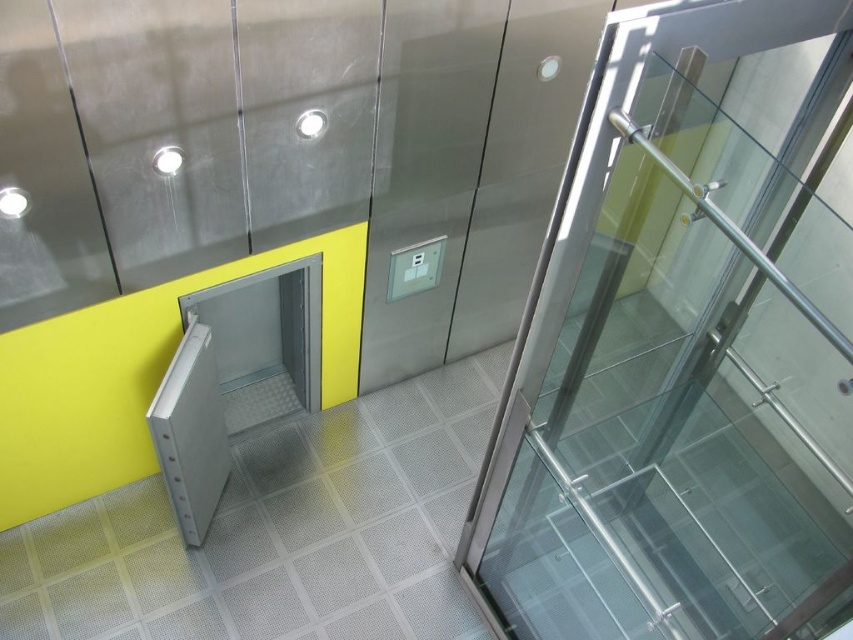
You are an elevator technician standing at the bottom of the elevator shaft. You need to reach the transparent glass door at center. According to the coordinates provided, where should you move to in order to reach it?

The transparent glass door at center is located at coordinates point (686,346), so you should move towards that point to reach it.

You are a delivery person carrying a large package that is 2.5 meters long. You need to move it through the space between the transparent glass door at center and the white matte lift door at center. Is there enough space for the package to fit through the gap between these two doors?

The distance between the transparent glass door at center and the white matte lift door at center is 2.54 meters. Since the package is 2.5 meters long, it should fit with a small amount of clearance. Therefore, there is enough space for the package to pass through the gap between the two doors.